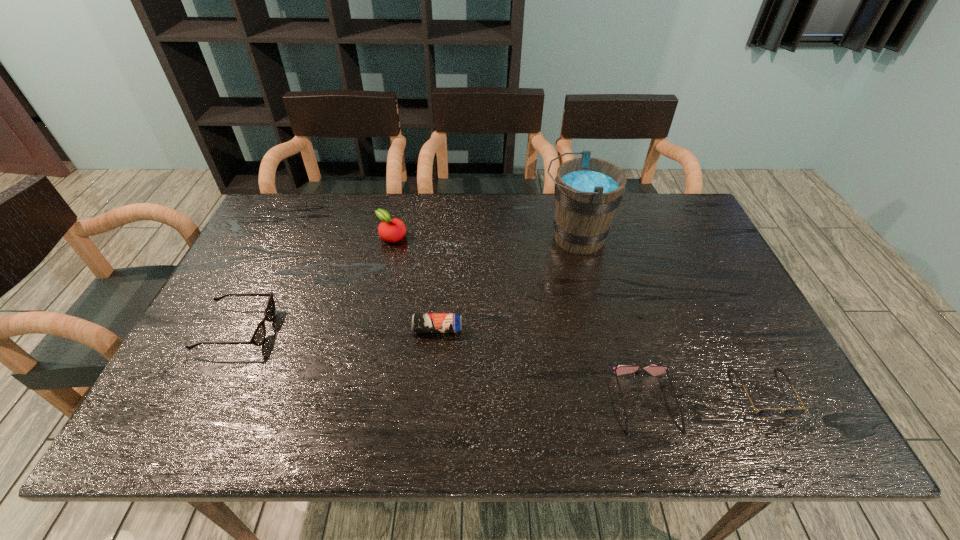
I want to click on vacant point located 0.080m with a handle on the side of the wine bucket, so click(514, 238).

Find the location of `vacant area located 0.280m with a handle on the side of the wine bucket`. vacant area located 0.280m with a handle on the side of the wine bucket is located at coordinates (449, 238).

Identify the location of free region located 0.120m on the right of the apple. Image resolution: width=960 pixels, height=540 pixels. (446, 237).

At what (x,y) coordinates should I click in order to perform the action: click on free space located 0.130m on the front lenses of the farthest sunglasses. Please return your answer as a coordinate pair (x, y). The width and height of the screenshot is (960, 540). Looking at the image, I should click on (322, 329).

Find the location of a particular element. The height and width of the screenshot is (540, 960). vacant space located 0.390m on the left of the third object from left to right is located at coordinates (260, 329).

Find the location of a particular element. wine bucket that is at the far edge is located at coordinates (588, 191).

What are the coordinates of `apple located in the far edge section of the desktop` in the screenshot? It's located at (391, 230).

Where is `object that is at the left edge`? object that is at the left edge is located at coordinates (258, 337).

Where is `object present at the right edge`? Image resolution: width=960 pixels, height=540 pixels. object present at the right edge is located at coordinates (768, 412).

This screenshot has height=540, width=960. In order to click on object that is at the near right corner in this screenshot , I will do `click(768, 412)`.